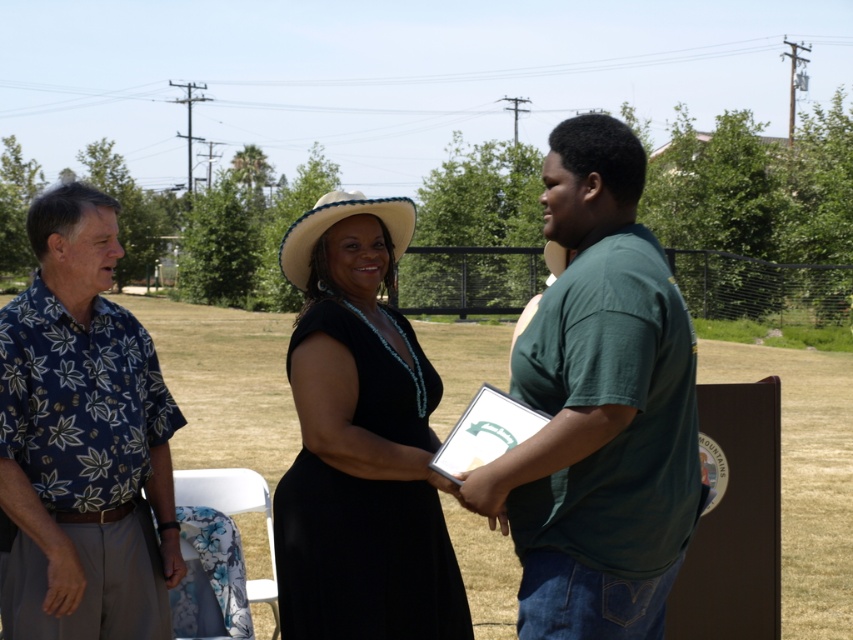
The height and width of the screenshot is (640, 853). Identify the location of green matte shirt at center. (599, 408).

Can you confirm if green matte shirt at center is taller than black matte dress at center?

Yes.

This screenshot has height=640, width=853. In order to click on green matte shirt at center in this screenshot , I will do `click(599, 408)`.

In order to click on green matte shirt at center in this screenshot , I will do `click(599, 408)`.

Is green matte shirt at center below blue floral shirt at left?

No, green matte shirt at center is not below blue floral shirt at left.

Between point (521, 472) and point (79, 548), which one is positioned behind?

Point (79, 548)

Locate an element on the screen. green matte shirt at center is located at coordinates (599, 408).

What do you see at coordinates (82, 440) in the screenshot? I see `blue floral shirt at left` at bounding box center [82, 440].

Can you confirm if blue floral shirt at left is bigger than white straw cowboy hat at center?

Yes.

Which is in front, point (0, 362) or point (283, 244)?

Point (0, 362) is in front.

You are a GUI agent. You are given a task and a screenshot of the screen. Output one action in this format:
    pyautogui.click(x=<x>, y=<y>)
    Task: Click on the blue floral shirt at left
    
    Given the screenshot: What is the action you would take?
    pyautogui.click(x=82, y=440)